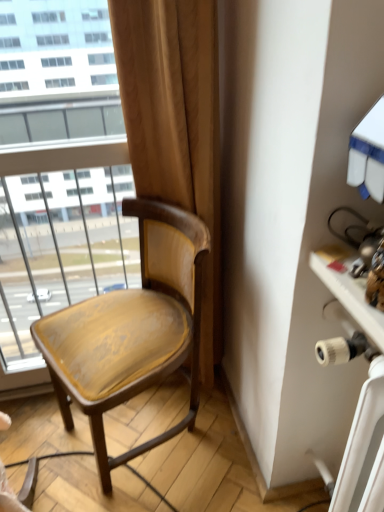
Question: Is wooden chair at center positioned beyond the bounds of white plastic table at right?

Choices:
 (A) no
 (B) yes

Answer: (B)

Question: From a real-world perspective, is wooden chair at center positioned over white plastic table at right based on gravity?

Choices:
 (A) no
 (B) yes

Answer: (A)

Question: Are wooden chair at center and white plastic table at right making contact?

Choices:
 (A) yes
 (B) no

Answer: (B)

Question: From a real-world perspective, is wooden chair at center located beneath white plastic table at right?

Choices:
 (A) no
 (B) yes

Answer: (B)

Question: Does wooden chair at center have a lesser height compared to white plastic table at right?

Choices:
 (A) no
 (B) yes

Answer: (A)

Question: Can you confirm if wooden chair at center is taller than white plastic table at right?

Choices:
 (A) no
 (B) yes

Answer: (B)

Question: From a real-world perspective, is white plastic table at right physically above wooden chair at center?

Choices:
 (A) yes
 (B) no

Answer: (A)

Question: Can we say white plastic table at right lies outside wooden chair at center?

Choices:
 (A) yes
 (B) no

Answer: (A)

Question: Could you tell me if white plastic table at right is facing wooden chair at center?

Choices:
 (A) yes
 (B) no

Answer: (B)

Question: Does white plastic table at right come in front of wooden chair at center?

Choices:
 (A) no
 (B) yes

Answer: (B)

Question: Is white plastic table at right taller than wooden chair at center?

Choices:
 (A) no
 (B) yes

Answer: (A)

Question: From the image's perspective, is white plastic table at right beneath wooden chair at center?

Choices:
 (A) yes
 (B) no

Answer: (A)

Question: Is point (157, 275) closer or farther from the camera than point (344, 352)?

Choices:
 (A) farther
 (B) closer

Answer: (A)